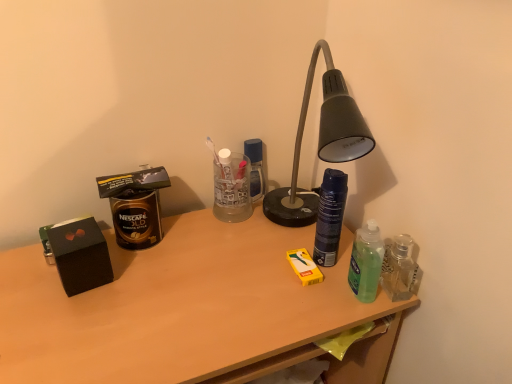
Identify the location of vacant area located to the right-hand side of gold matte canister at left. (212, 246).